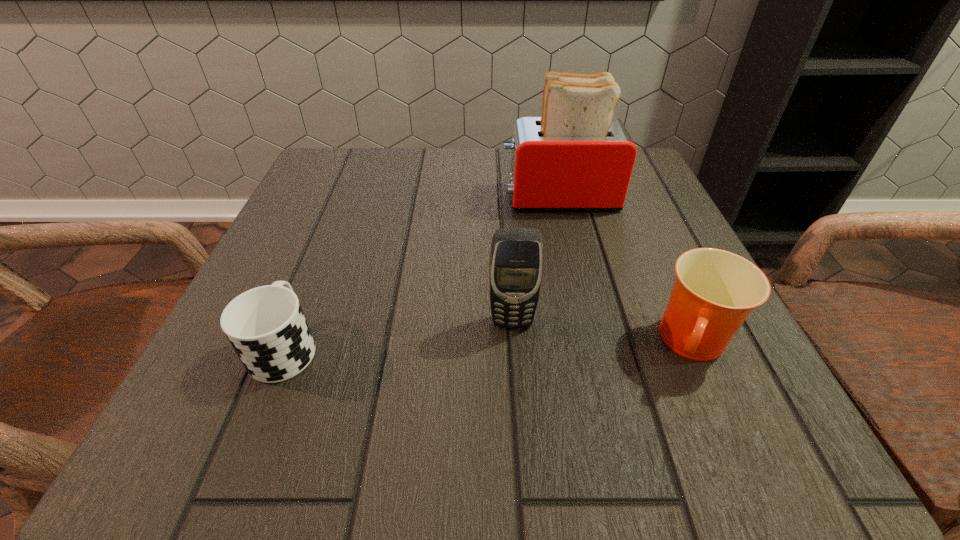
At what (x,y) coordinates should I click in order to perform the action: click on vacant space that's between the right cup and the cellular telephone. Please return your answer as a coordinate pair (x, y). This screenshot has height=540, width=960. Looking at the image, I should click on (603, 333).

Locate an element on the screen. free area in between the toaster and the right cup is located at coordinates (627, 271).

Where is `free space between the leftmost object and the tallest object`? This screenshot has height=540, width=960. free space between the leftmost object and the tallest object is located at coordinates (422, 272).

Identify the location of free space between the shorter cup and the third tallest object. The height and width of the screenshot is (540, 960). (490, 346).

This screenshot has width=960, height=540. I want to click on object that stands as the closest to the second shortest object, so click(x=516, y=259).

Select which object appears as the third closest to the third tallest object. Please provide its 2D coordinates. Your answer should be formatted as a tuple, i.e. [(x, y)], where the tuple contains the x and y coordinates of a point satisfying the conditions above.

[(266, 326)]

I want to click on free space that satisfies the following two spatial constraints: 1. on the front-facing side of the tallest object; 2. on the front face of the third shortest object, so click(588, 322).

Locate an element on the screen. This screenshot has height=540, width=960. blank area in the image that satisfies the following two spatial constraints: 1. on the front face of the second shortest object; 2. on the left side of the second tallest object is located at coordinates (514, 345).

Where is `vacant region that satisfies the following two spatial constraints: 1. on the back side of the taller cup; 2. on the front-facing side of the toaster`? Image resolution: width=960 pixels, height=540 pixels. vacant region that satisfies the following two spatial constraints: 1. on the back side of the taller cup; 2. on the front-facing side of the toaster is located at coordinates (629, 197).

The image size is (960, 540). Find the location of `free space that satisfies the following two spatial constraints: 1. on the side of the left cup with the handle; 2. on the left side of the right cup`. free space that satisfies the following two spatial constraints: 1. on the side of the left cup with the handle; 2. on the left side of the right cup is located at coordinates (286, 345).